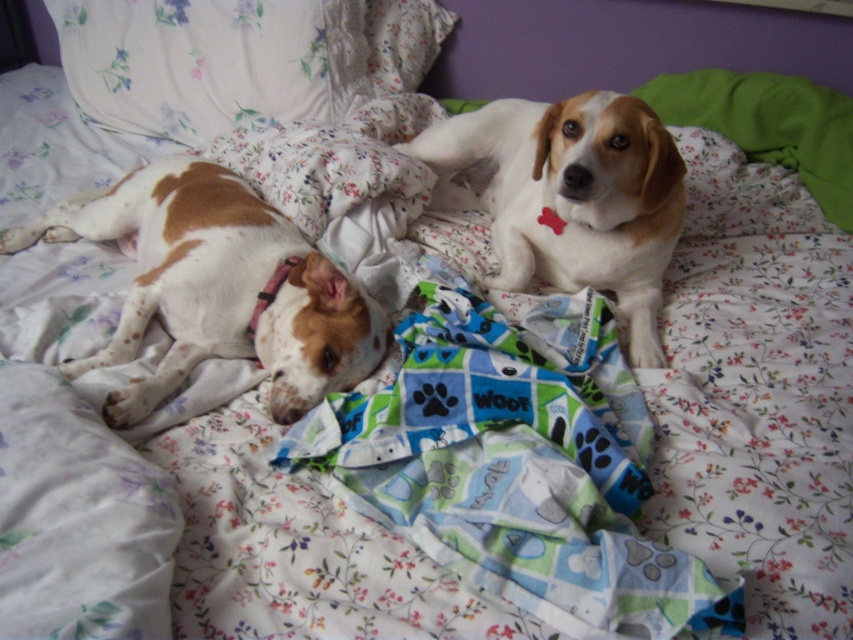
Question: Which of the following is the farthest from the observer?

Choices:
 (A) (84, 33)
 (B) (167, 205)
 (C) (488, 513)

Answer: (A)

Question: Is speckled white fur at left bigger than white soft fur dog at upper right?

Choices:
 (A) no
 (B) yes

Answer: (B)

Question: Which point is closer to the camera?

Choices:
 (A) speckled white fur at left
 (B) white soft fur dog at upper right
 (C) blue fabric paw print blanket at center
 (D) fluffy white pillow at upper left

Answer: (C)

Question: Estimate the real-world distances between objects in this image. Which object is farther from the blue fabric paw print blanket at center?

Choices:
 (A) speckled white fur at left
 (B) white soft fur dog at upper right

Answer: (A)

Question: Where is fluffy white pillow at upper left located in relation to white soft fur dog at upper right in the image?

Choices:
 (A) right
 (B) left

Answer: (B)

Question: Is blue fabric paw print blanket at center in front of speckled white fur at left?

Choices:
 (A) no
 (B) yes

Answer: (B)